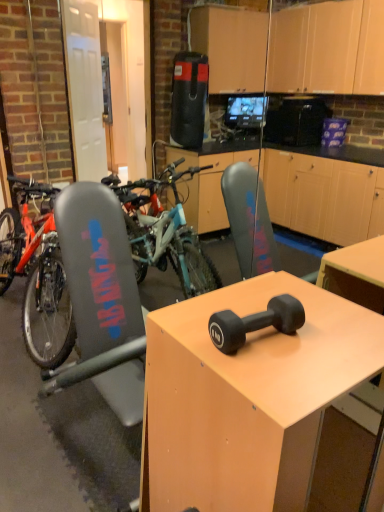
Locate an element on the screen. vacant space situated above matte black dumbbell at center (from a real-world perspective) is located at coordinates (273, 329).